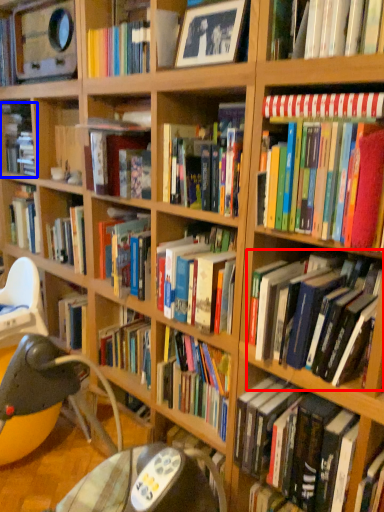
Question: Which object is further to the camera taking this photo, book (highlighted by a red box) or book (highlighted by a blue box)?

Choices:
 (A) book
 (B) book

Answer: (B)